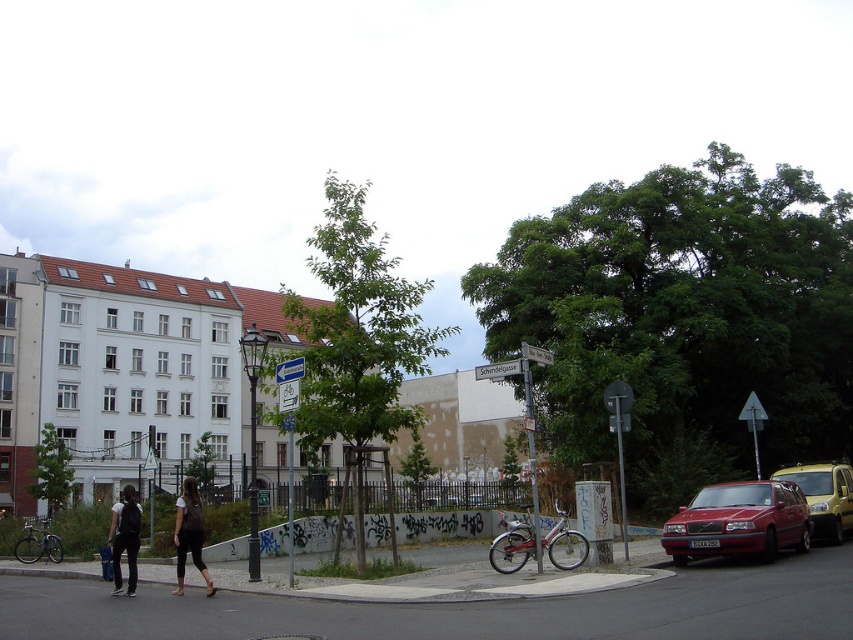
Question: Which point appears farthest from the camera in this image?

Choices:
 (A) (115, 548)
 (B) (115, 552)

Answer: (A)

Question: Can you confirm if shiny red car at lower right is positioned above yellow matte taxi at right?

Choices:
 (A) no
 (B) yes

Answer: (B)

Question: Based on their relative distances, which object is nearer to the dark brown leather jacket at lower left?

Choices:
 (A) yellow matte taxi at right
 (B) dark brown leather backpack at lower left
 (C) dark gray fabric jacket at lower left

Answer: (B)

Question: Is yellow matte taxi at right thinner than dark brown leather jacket at lower left?

Choices:
 (A) yes
 (B) no

Answer: (A)

Question: Does shiny red car at lower right appear under dark brown leather backpack at lower left?

Choices:
 (A) yes
 (B) no

Answer: (B)

Question: Which point is closer to the camera taking this photo?

Choices:
 (A) (181, 548)
 (B) (184, 531)
 (C) (753, 513)

Answer: (A)